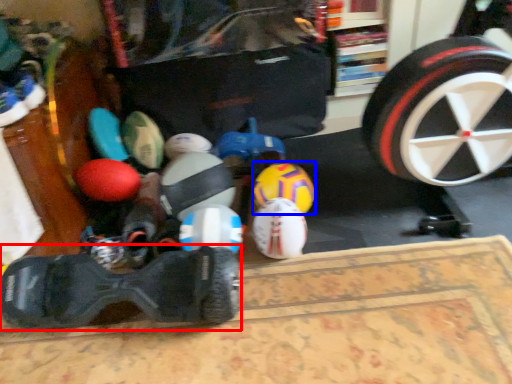
Question: Among these objects, which one is nearest to the camera, footwear (highlighted by a red box) or toy (highlighted by a blue box)?

Choices:
 (A) footwear
 (B) toy

Answer: (A)